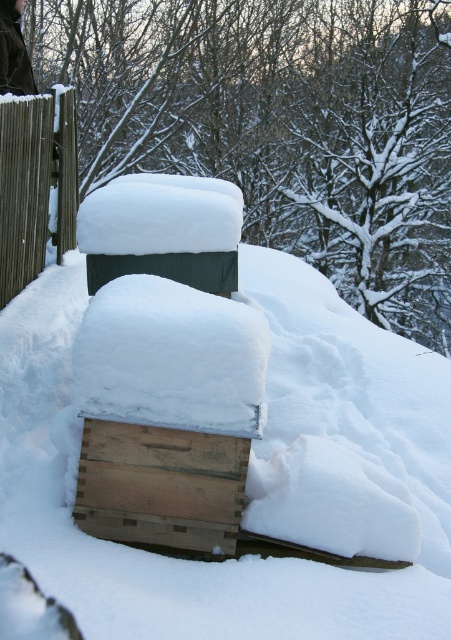
Who is positioned more to the right, wooden crate at center or brown wooden fence at left?

Positioned to the right is wooden crate at center.

Consider the image. Who is more forward, (128,509) or (26,154)?

Point (128,509) is more forward.

In order to click on wooden crate at center in this screenshot , I will do `click(161, 484)`.